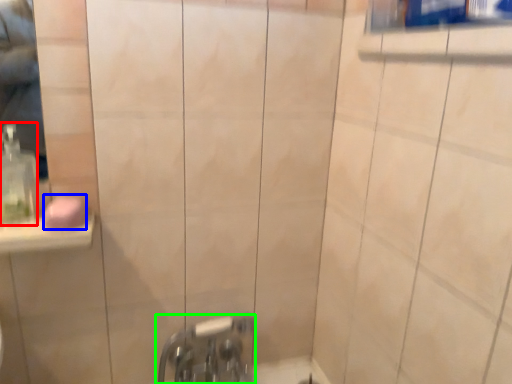
Question: Which object is positioned closest to soap dispenser (highlighted by a red box)? Select from soap (highlighted by a blue box) and tap (highlighted by a green box).

Choices:
 (A) soap
 (B) tap

Answer: (A)